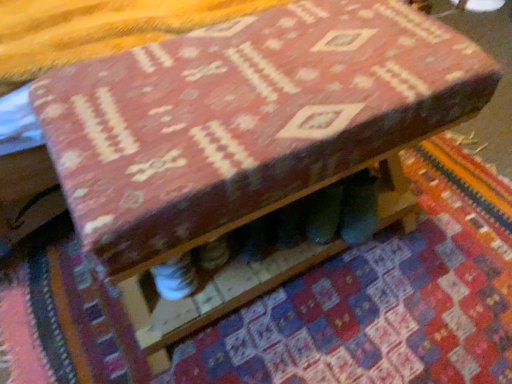
What is the approximate height of textured woolen mat at center?

1.58 inches.

Identify the location of textured woolen mat at center. Image resolution: width=512 pixels, height=384 pixels. (385, 298).

Describe the element at coordinates (385, 298) in the screenshot. I see `textured woolen mat at center` at that location.

Where is `textured woolen mat at center`? The width and height of the screenshot is (512, 384). textured woolen mat at center is located at coordinates click(385, 298).